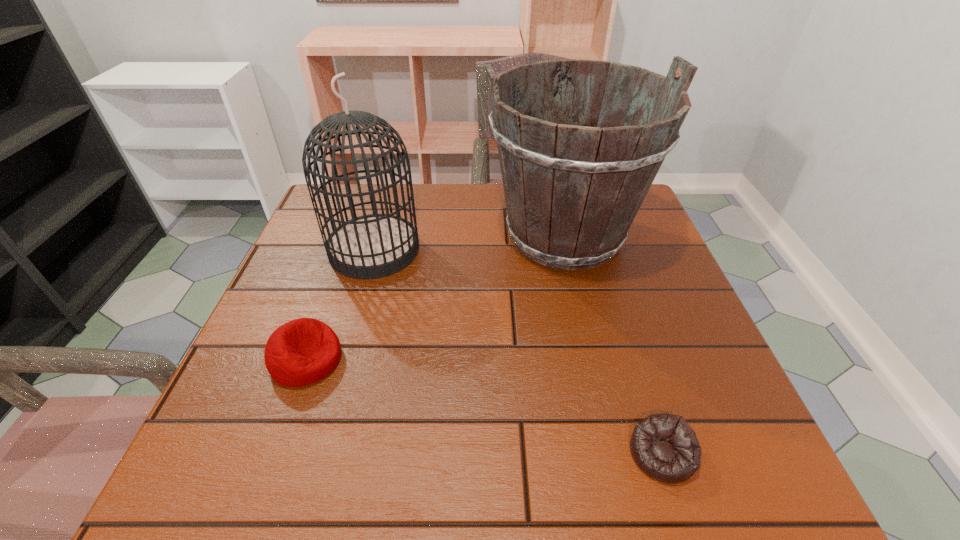
Find the location of `birdcage present at the far edge`. birdcage present at the far edge is located at coordinates (372, 246).

This screenshot has width=960, height=540. Find the location of `bucket that is at the far edge`. bucket that is at the far edge is located at coordinates (572, 192).

Where is `object located in the near edge section of the desktop`? object located in the near edge section of the desktop is located at coordinates (664, 446).

Find the location of `birdcage located in the left edge section of the desktop`. birdcage located in the left edge section of the desktop is located at coordinates (372, 246).

This screenshot has height=540, width=960. I want to click on beanbag at the left edge, so click(x=303, y=351).

Locate an element on the screen. bucket that is at the right edge is located at coordinates (572, 192).

You are a GUI agent. You are given a task and a screenshot of the screen. Output one action in this format:
    pyautogui.click(x=<x>, y=<y>)
    Task: Click on the beanbag that is at the right edge
    This screenshot has height=540, width=960.
    Given the screenshot: What is the action you would take?
    pyautogui.click(x=664, y=446)

This screenshot has width=960, height=540. What are the coordinates of `object at the far left corner` in the screenshot? It's located at tap(372, 246).

Identify the location of object positioned at the far right corner. The width and height of the screenshot is (960, 540). (572, 192).

Where is `object located at the near right corner`? The height and width of the screenshot is (540, 960). object located at the near right corner is located at coordinates (664, 446).